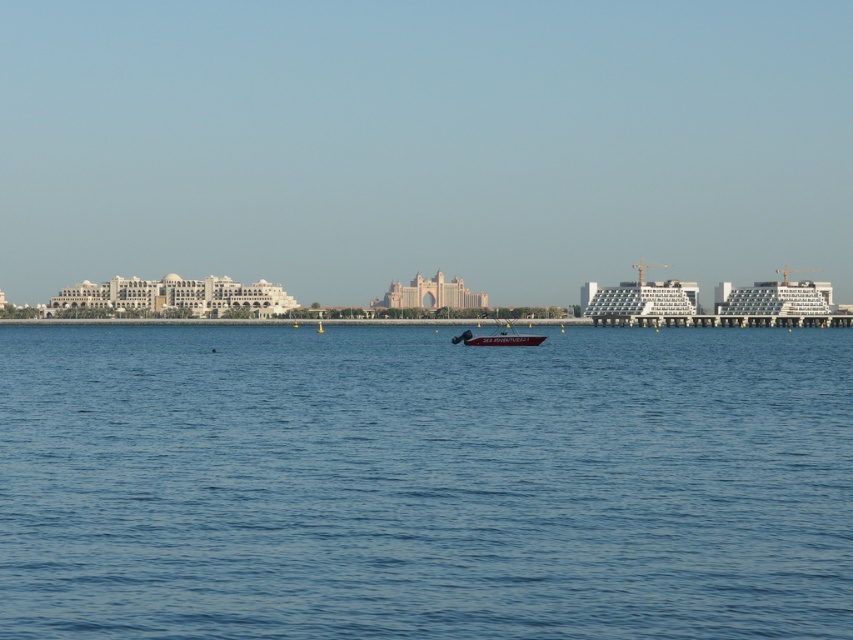
Question: Is blue water at center above brushed metal boat at center?

Choices:
 (A) no
 (B) yes

Answer: (A)

Question: Among these points, which one is farthest from the camera?

Choices:
 (A) (469, 342)
 (B) (166, 401)

Answer: (A)

Question: Which object is farther from the camera taking this photo?

Choices:
 (A) blue water at center
 (B) brushed metal boat at center

Answer: (B)

Question: Can you confirm if blue water at center is thinner than brushed metal boat at center?

Choices:
 (A) no
 (B) yes

Answer: (A)

Question: Which point is farther to the camera?

Choices:
 (A) blue water at center
 (B) brushed metal boat at center

Answer: (B)

Question: From the image, what is the correct spatial relationship of blue water at center in relation to brushed metal boat at center?

Choices:
 (A) left
 (B) right

Answer: (A)